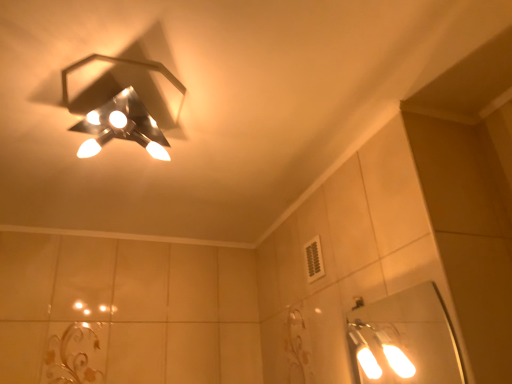
What do you see at coordinates (121, 123) in the screenshot?
I see `metallic hexagonal light fixture at upper left` at bounding box center [121, 123].

Locate an element on the screen. metallic hexagonal light fixture at upper left is located at coordinates (121, 123).

At what (x,y) coordinates should I click in order to perform the action: click on white glossy mirror at lower right. Please return your answer as a coordinate pair (x, y). The width and height of the screenshot is (512, 384). Looking at the image, I should click on (405, 340).

The image size is (512, 384). Describe the element at coordinates (405, 340) in the screenshot. I see `white glossy mirror at lower right` at that location.

In order to click on metallic hexagonal light fixture at upper left in this screenshot , I will do `click(121, 123)`.

Does white glossy mirror at lower right appear on the left side of metallic hexagonal light fixture at upper left?

In fact, white glossy mirror at lower right is to the right of metallic hexagonal light fixture at upper left.

Is white glossy mirror at lower right closer to the viewer compared to metallic hexagonal light fixture at upper left?

No, white glossy mirror at lower right is behind metallic hexagonal light fixture at upper left.

Considering the points (365, 310) and (165, 75), which point is behind, point (365, 310) or point (165, 75)?

The point (365, 310) is farther from the camera.

From the image's perspective, which object appears higher, white glossy mirror at lower right or metallic hexagonal light fixture at upper left?

metallic hexagonal light fixture at upper left is shown above in the image.

From the picture: From a real-world perspective, relative to metallic hexagonal light fixture at upper left, is white glossy mirror at lower right vertically above or below?

white glossy mirror at lower right is situated lower than metallic hexagonal light fixture at upper left in the real world.

Does white glossy mirror at lower right have a lesser width compared to metallic hexagonal light fixture at upper left?

Yes, white glossy mirror at lower right is thinner than metallic hexagonal light fixture at upper left.

Considering the sizes of white glossy mirror at lower right and metallic hexagonal light fixture at upper left in the image, is white glossy mirror at lower right taller or shorter than metallic hexagonal light fixture at upper left?

Considering their sizes, white glossy mirror at lower right has more height than metallic hexagonal light fixture at upper left.

Considering the sizes of white glossy mirror at lower right and metallic hexagonal light fixture at upper left in the image, is white glossy mirror at lower right bigger or smaller than metallic hexagonal light fixture at upper left?

Considering their sizes, white glossy mirror at lower right takes up less space than metallic hexagonal light fixture at upper left.

Is white glossy mirror at lower right inside the boundaries of metallic hexagonal light fixture at upper left, or outside?

white glossy mirror at lower right exists outside the volume of metallic hexagonal light fixture at upper left.

Is white glossy mirror at lower right touching metallic hexagonal light fixture at upper left?

No, white glossy mirror at lower right is not with metallic hexagonal light fixture at upper left.

Is white glossy mirror at lower right looking in the opposite direction of metallic hexagonal light fixture at upper left?

No.

How different are the orientations of white glossy mirror at lower right and metallic hexagonal light fixture at upper left in degrees?

The angular difference between white glossy mirror at lower right and metallic hexagonal light fixture at upper left is 91.1 degrees.

Image resolution: width=512 pixels, height=384 pixels. What are the coordinates of `mirror below the metallic hexagonal light fixture at upper left (from a real-world perspective)` in the screenshot? It's located at (405, 340).

Would you say metallic hexagonal light fixture at upper left is to the left or to the right of white glossy mirror at lower right in the picture?

In the image, metallic hexagonal light fixture at upper left appears on the left side of white glossy mirror at lower right.

Relative to white glossy mirror at lower right, is metallic hexagonal light fixture at upper left in front or behind?

Visually, metallic hexagonal light fixture at upper left is located in front of white glossy mirror at lower right.

Does point (161, 145) come in front of point (359, 379)?

Yes, point (161, 145) is closer to viewer.

From the image's perspective, does metallic hexagonal light fixture at upper left appear lower than white glossy mirror at lower right?

No.

From a real-world perspective, is metallic hexagonal light fixture at upper left positioned under white glossy mirror at lower right based on gravity?

No, from a real-world perspective, metallic hexagonal light fixture at upper left is not below white glossy mirror at lower right.

Considering the sizes of objects metallic hexagonal light fixture at upper left and white glossy mirror at lower right in the image provided, who is thinner, metallic hexagonal light fixture at upper left or white glossy mirror at lower right?

Thinner between the two is white glossy mirror at lower right.

Can you confirm if metallic hexagonal light fixture at upper left is shorter than white glossy mirror at lower right?

Indeed, metallic hexagonal light fixture at upper left has a lesser height compared to white glossy mirror at lower right.

Considering the sizes of objects metallic hexagonal light fixture at upper left and white glossy mirror at lower right in the image provided, who is smaller, metallic hexagonal light fixture at upper left or white glossy mirror at lower right?

white glossy mirror at lower right is smaller.

Is metallic hexagonal light fixture at upper left not inside white glossy mirror at lower right?

Yes.

Is metallic hexagonal light fixture at upper left far away from white glossy mirror at lower right?

Indeed, metallic hexagonal light fixture at upper left is not near white glossy mirror at lower right.

Is metallic hexagonal light fixture at upper left looking in the opposite direction of white glossy mirror at lower right?

No, metallic hexagonal light fixture at upper left's orientation is not away from white glossy mirror at lower right.

This screenshot has height=384, width=512. What are the coordinates of `mirror below the metallic hexagonal light fixture at upper left (from a real-world perspective)` in the screenshot? It's located at (405, 340).

The width and height of the screenshot is (512, 384). I want to click on mirror that is under the metallic hexagonal light fixture at upper left (from a real-world perspective), so 405,340.

I want to click on lamp that appears above the white glossy mirror at lower right (from a real-world perspective), so click(x=121, y=123).